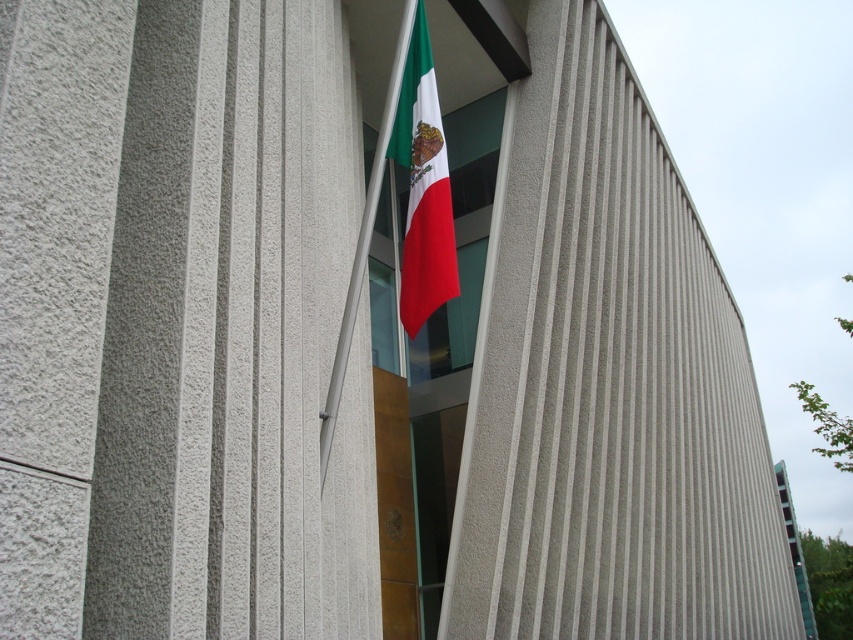
At what (x,y) coordinates should I click in order to perform the action: click on glass window at center. Please return your answer as a coordinate pair (x, y). Looking at the image, I should click on (462, 236).

Can you confirm if glass window at center is taller than red fabric flag at center?

Correct, glass window at center is much taller as red fabric flag at center.

Based on the photo, measure the distance between glass window at center and camera.

glass window at center and camera are 37.46 feet apart from each other.

The width and height of the screenshot is (853, 640). Identify the location of glass window at center. (462, 236).